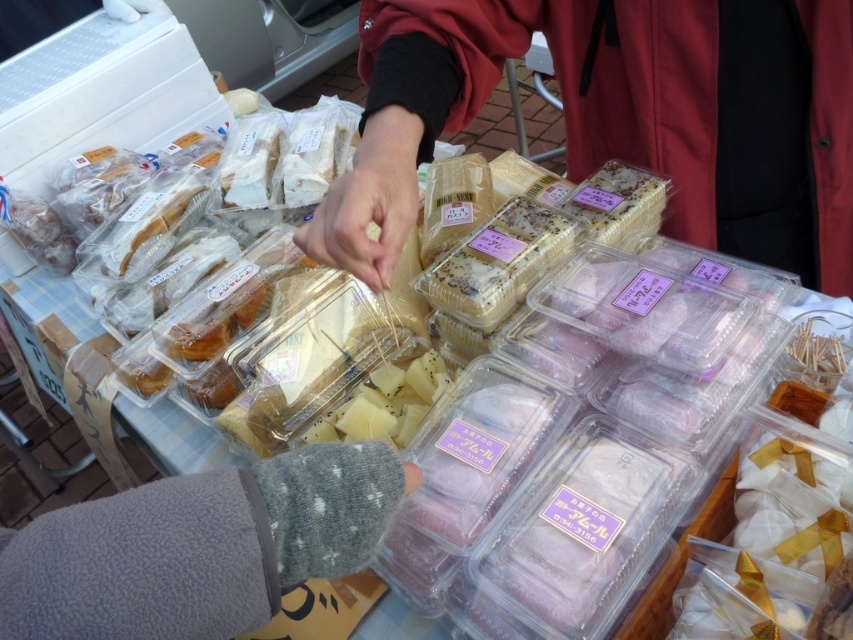
Question: Can you confirm if smooth red jacket at center is wider than gray fleece glove at lower left?

Choices:
 (A) no
 (B) yes

Answer: (B)

Question: Among these objects, which one is farthest from the camera?

Choices:
 (A) smooth red jacket at center
 (B) gray fleece glove at lower left

Answer: (A)

Question: Is smooth red jacket at center closer to the viewer compared to gray fleece glove at lower left?

Choices:
 (A) no
 (B) yes

Answer: (A)

Question: Can you confirm if smooth red jacket at center is positioned to the right of gray fleece glove at lower left?

Choices:
 (A) yes
 (B) no

Answer: (A)